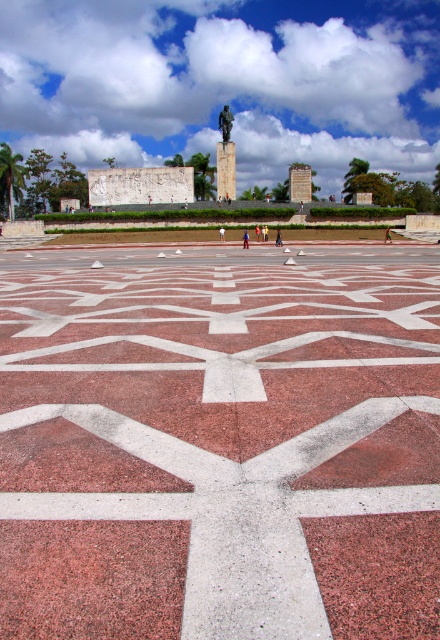
Question: Does red granite square at center appear on the left side of matte black statue at center?

Choices:
 (A) yes
 (B) no

Answer: (A)

Question: Considering the real-world distances, which object is closest to the white cotton shirt at center?

Choices:
 (A) green fabric person at center
 (B) granite at center
 (C) green patina statue at center
 (D) red granite square at center

Answer: (A)

Question: Which of the following is the farthest from the observer?

Choices:
 (A) red granite square at center
 (B) multicolored fabric person at center

Answer: (B)

Question: Is red granite plaza at center to the right of matte black statue at center from the viewer's perspective?

Choices:
 (A) no
 (B) yes

Answer: (A)

Question: Which object is the farthest from the multicolored fabric person at center?

Choices:
 (A) white cotton shirt at center
 (B) matte black statue at center

Answer: (B)

Question: Can you confirm if red granite plaza at center is thinner than green fabric person at center?

Choices:
 (A) yes
 (B) no

Answer: (B)